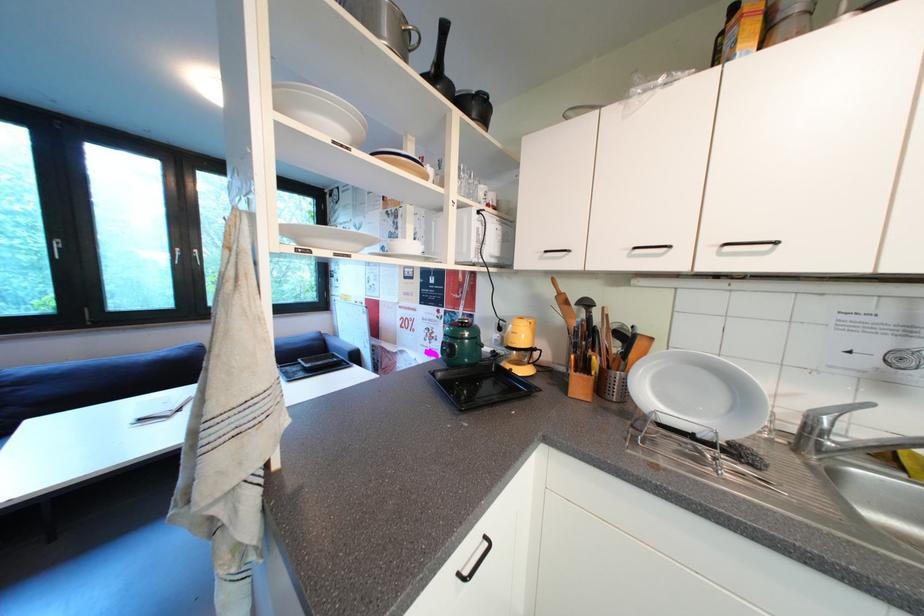
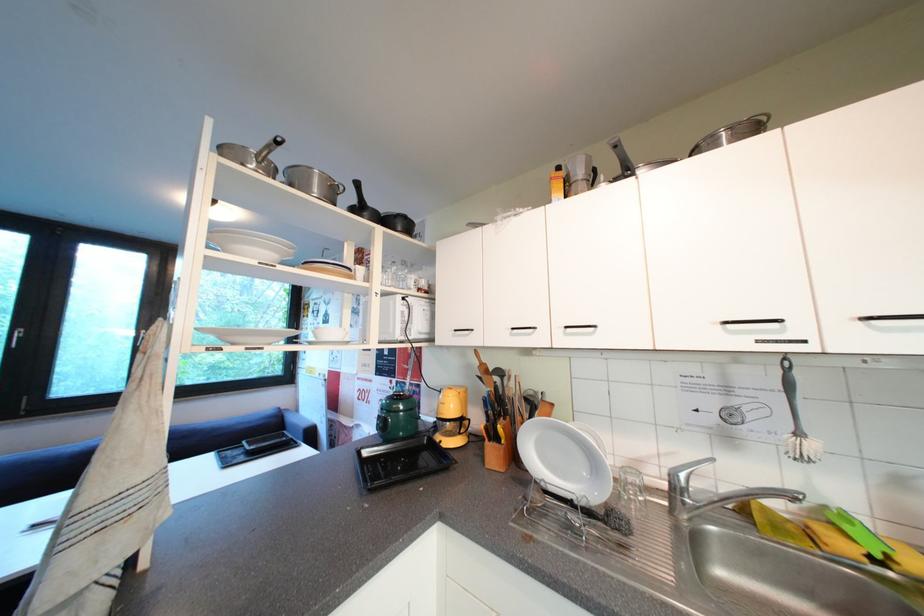
In a continuous first-person perspective shot, in which direction is the camera moving?

The cameraman moved toward right, backward.